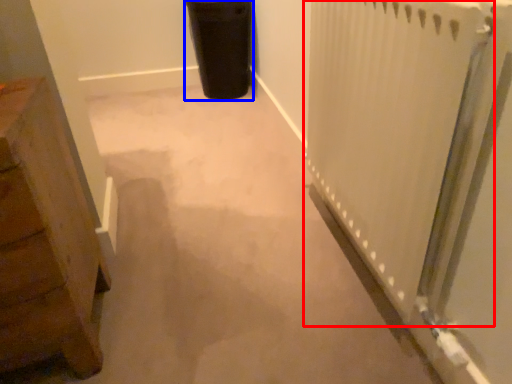
Question: Which point is closer to the camera, radiator (highlighted by a red box) or garbage (highlighted by a blue box)?

Choices:
 (A) radiator
 (B) garbage

Answer: (A)